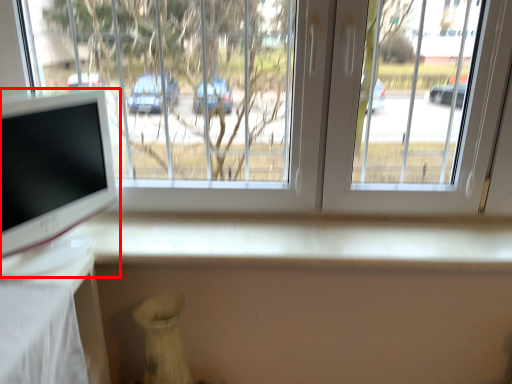
Question: From the image's perspective, where is computer monitor (annotated by the red box) located relative to window?

Choices:
 (A) below
 (B) above

Answer: (A)